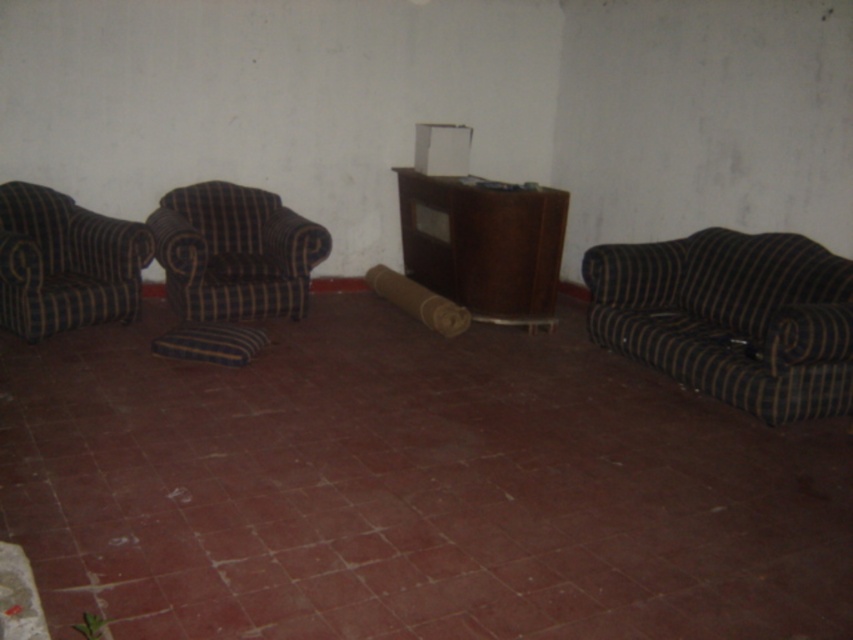
Is brown wooden cabinet at center positioned before striped fabric armchair at left?

No, brown wooden cabinet at center is further to the viewer.

Which is in front, point (527, 316) or point (56, 282)?

Point (56, 282) is more forward.

I want to click on brown wooden cabinet at center, so click(485, 244).

Image resolution: width=853 pixels, height=640 pixels. I want to click on brown wooden cabinet at center, so click(485, 244).

Is striped fabric couch at right to the right of blue striped pillow at lower right from the viewer's perspective?

Incorrect, striped fabric couch at right is not on the right side of blue striped pillow at lower right.

Does striped fabric couch at right appear on the left side of blue striped pillow at lower right?

Correct, you'll find striped fabric couch at right to the left of blue striped pillow at lower right.

Between point (724, 307) and point (825, 323), which one is positioned behind?

Positioned behind is point (724, 307).

Identify the location of striped fabric couch at right. (732, 317).

Between brown wooden cabinet at center and blue striped pillow at lower right, which one has more height?

With more height is brown wooden cabinet at center.

Does brown wooden cabinet at center lie in front of blue striped pillow at lower right?

That is False.

At what (x,y) coordinates should I click in order to perform the action: click on brown wooden cabinet at center. Please return your answer as a coordinate pair (x, y). Image resolution: width=853 pixels, height=640 pixels. Looking at the image, I should click on (485, 244).